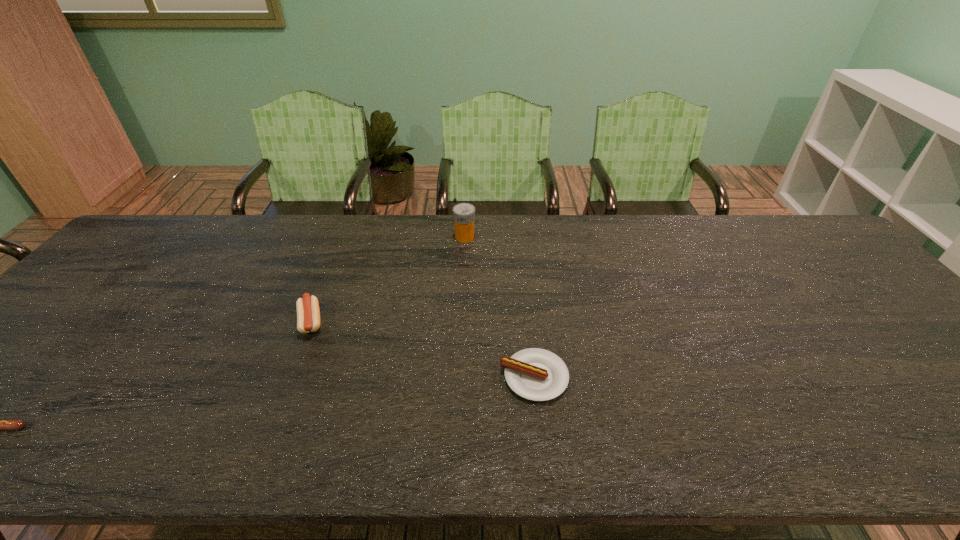
The width and height of the screenshot is (960, 540). I want to click on vacant space at the far edge of the desktop, so click(252, 241).

Locate an element on the screen. The width and height of the screenshot is (960, 540). vacant space at the near edge of the desktop is located at coordinates (648, 456).

Identify the location of vacant space at the left edge of the desktop. This screenshot has width=960, height=540. (84, 319).

Locate an element on the screen. The image size is (960, 540). free location at the far left corner of the desktop is located at coordinates (117, 255).

The width and height of the screenshot is (960, 540). What are the coordinates of `free space between the third object from right to left and the second nearest object` in the screenshot? It's located at (422, 349).

Identify the location of vacant area that lies between the second sausage from left to right and the farthest object. Image resolution: width=960 pixels, height=540 pixels. (388, 279).

Locate an element on the screen. The height and width of the screenshot is (540, 960). free space between the second tallest object and the farthest object is located at coordinates (388, 279).

Find the location of `empty space that is in between the rightmost sausage and the second tallest object`. empty space that is in between the rightmost sausage and the second tallest object is located at coordinates (422, 349).

You are a GUI agent. You are given a task and a screenshot of the screen. Output one action in this format:
    pyautogui.click(x=<x>, y=<y>)
    Task: Click on the vacant area that lies between the third tallest object and the farthest object
    The width and height of the screenshot is (960, 540).
    Given the screenshot: What is the action you would take?
    pyautogui.click(x=499, y=307)

At what (x,y) coordinates should I click in order to perform the action: click on free space between the tallest object and the farthest sausage. Please return your answer as a coordinate pair (x, y). Image resolution: width=960 pixels, height=540 pixels. Looking at the image, I should click on (388, 279).